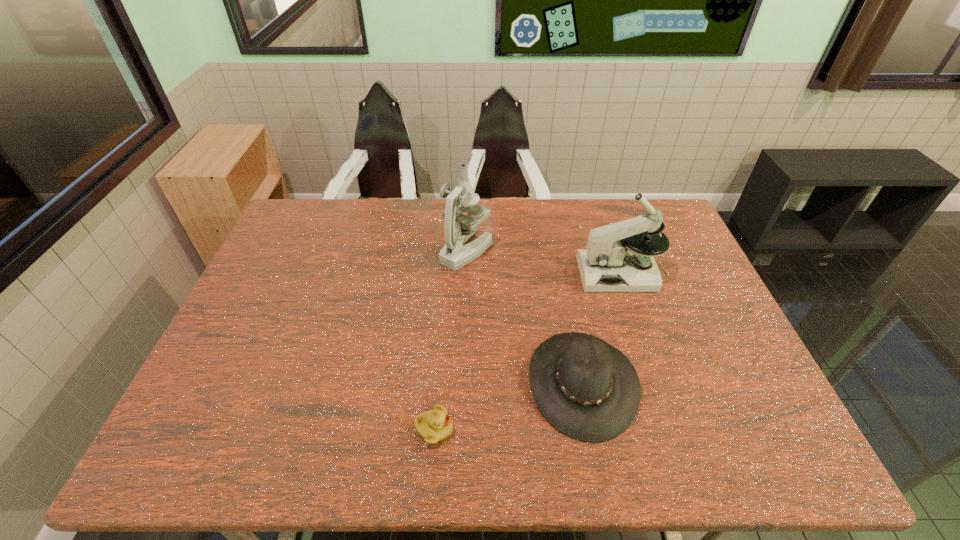
The image size is (960, 540). I want to click on free space at the near right corner of the desktop, so click(x=767, y=452).

Find the location of a particular element. This screenshot has height=540, width=960. vacant area between the shortest object and the right microscope is located at coordinates (526, 352).

What are the coordinates of `vacant space in between the right microscope and the left microscope` in the screenshot? It's located at (542, 262).

Where is `blank region between the left microscope and the right microscope`? The height and width of the screenshot is (540, 960). blank region between the left microscope and the right microscope is located at coordinates (542, 262).

At what (x,y) coordinates should I click in order to perform the action: click on vacant area that lies between the hat and the left microscope. Please return your answer as a coordinate pair (x, y). Looking at the image, I should click on (524, 316).

Find the location of a particular element. Image resolution: width=960 pixels, height=540 pixels. vacant space that's between the right microscope and the left microscope is located at coordinates tap(542, 262).

What are the coordinates of `vacant point located between the hat and the duckling` in the screenshot? It's located at (508, 406).

Find the location of `vacant point located between the hat and the shortest object`. vacant point located between the hat and the shortest object is located at coordinates (508, 406).

Locate an element on the screen. The image size is (960, 540). blank region between the hat and the right microscope is located at coordinates (600, 328).

Locate an element on the screen. Image resolution: width=960 pixels, height=540 pixels. vacant space that is in between the hat and the right microscope is located at coordinates (600, 328).